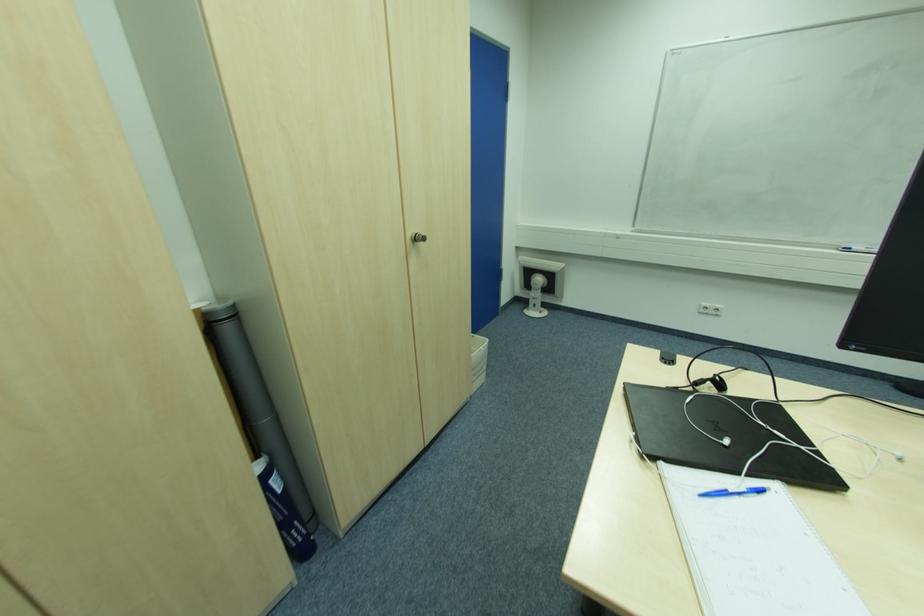
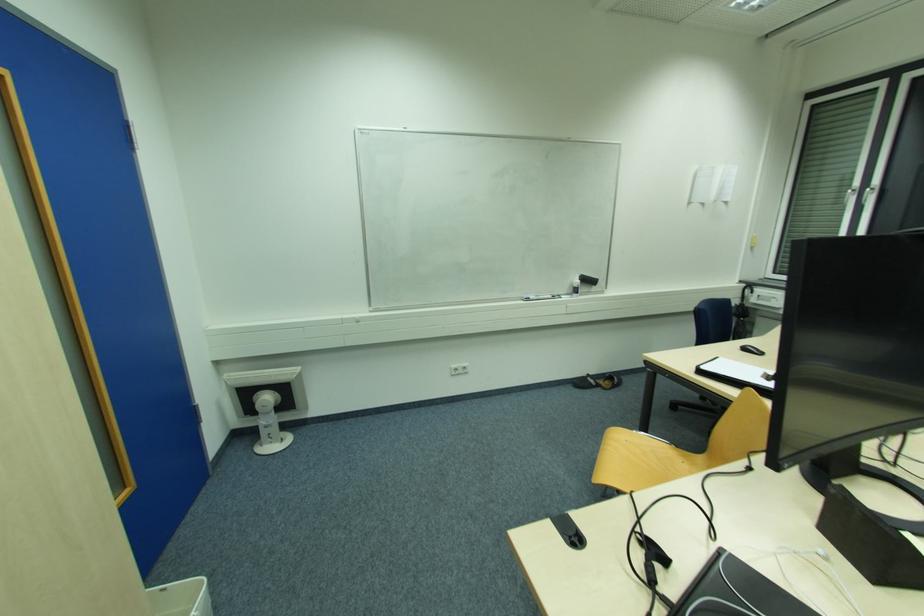
Where in the second image is the point corresponding to the point at 671,363 from the first image?

(578, 541)